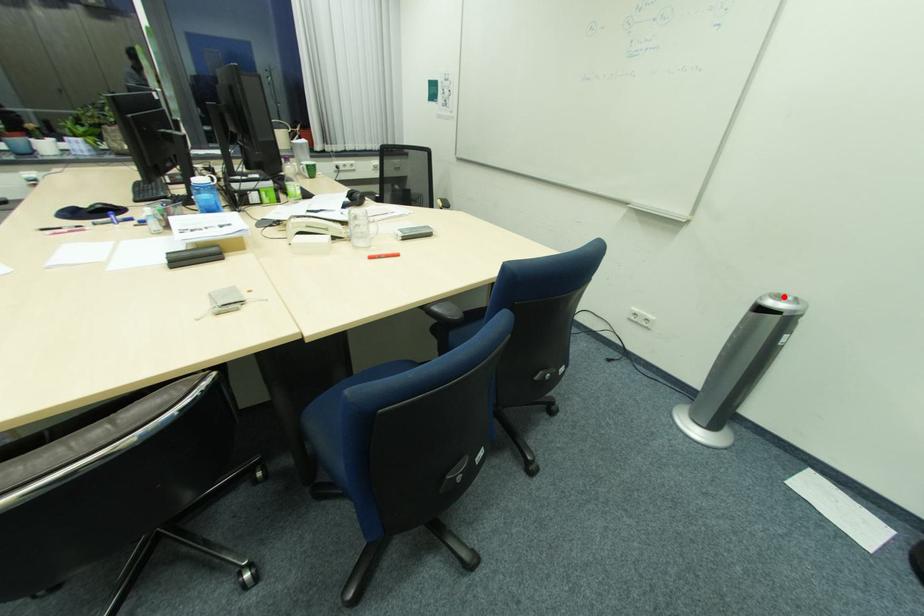
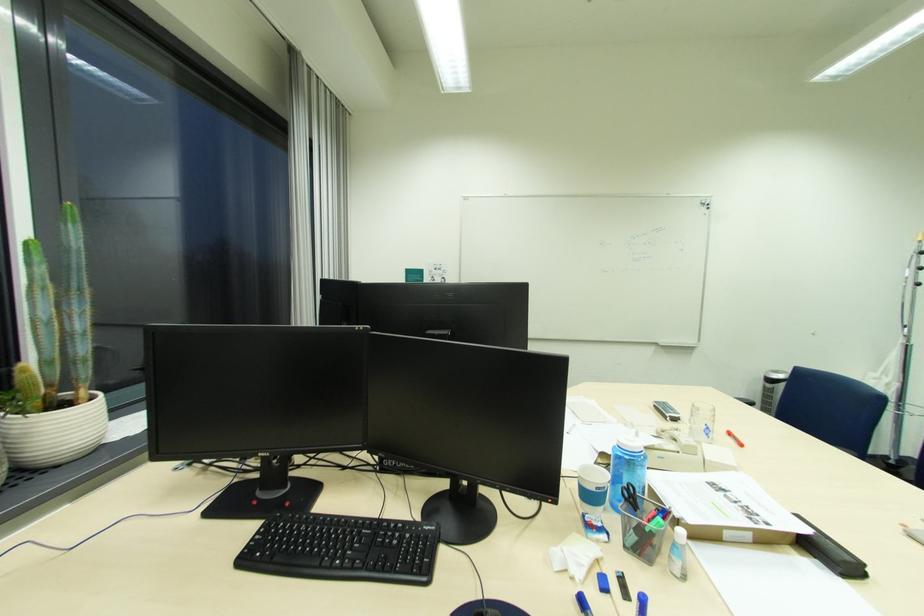
The point at the highlighted location is marked in the first image. Where is the corresponding point in the second image?

(782, 373)